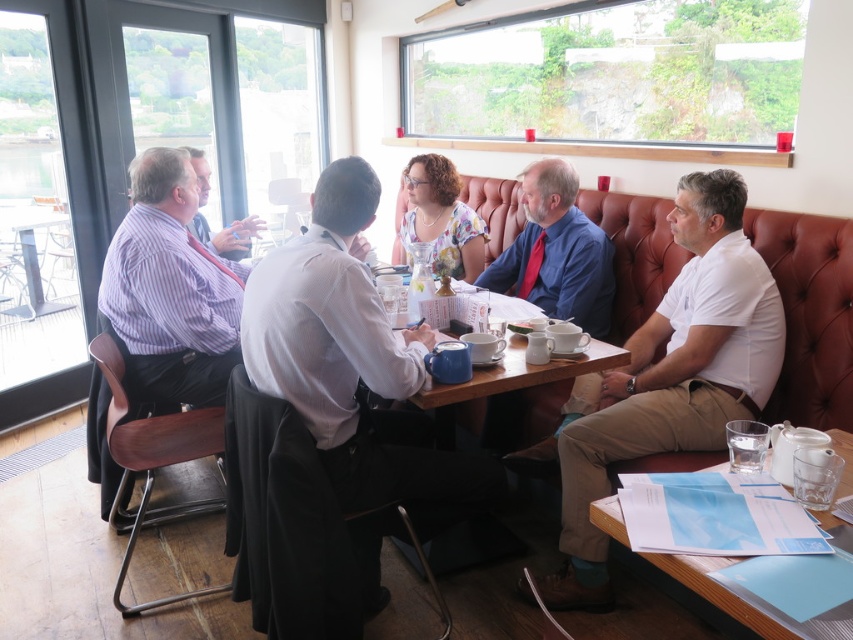
Question: Considering the real-world distances, which object is farthest from the clear glass water at lower right?

Choices:
 (A) white shirt at center
 (B) wooden table at lower right

Answer: (A)

Question: Which point is farther from the camera taking this photo?

Choices:
 (A) (163, 253)
 (B) (229, 237)
 (C) (699, 182)
 (D) (321, 308)

Answer: (B)

Question: Can you confirm if striped shirt at left is thinner than matte white shirt at center?

Choices:
 (A) yes
 (B) no

Answer: (B)

Question: Does matte blue shirt at center appear under clear glass water at lower right?

Choices:
 (A) no
 (B) yes

Answer: (A)

Question: Estimate the real-world distances between objects in this image. Which object is closer to the clear glass water at lower right?

Choices:
 (A) wooden table at lower right
 (B) striped shirt at left
 (C) white shirt at center
 (D) white cotton shirt at right

Answer: (A)

Question: Does striped shirt at left lie in front of matte blue shirt at center?

Choices:
 (A) no
 (B) yes

Answer: (B)